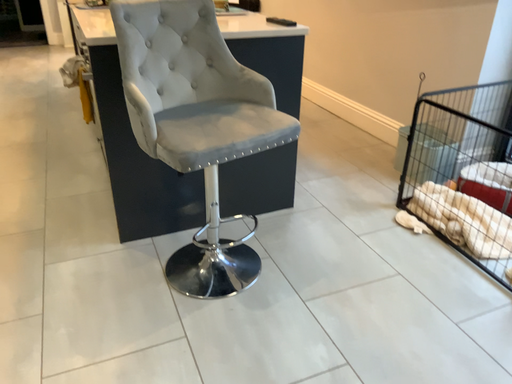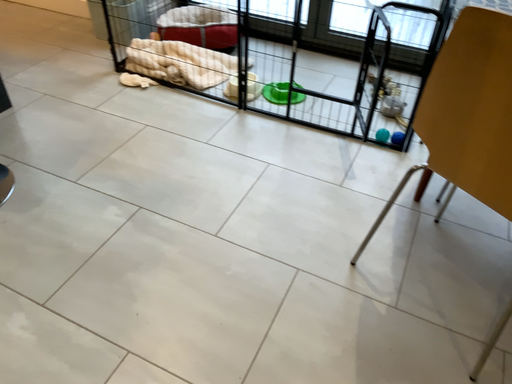
Question: Which way did the camera rotate in the video?

Choices:
 (A) rotated downward
 (B) rotated upward

Answer: (A)